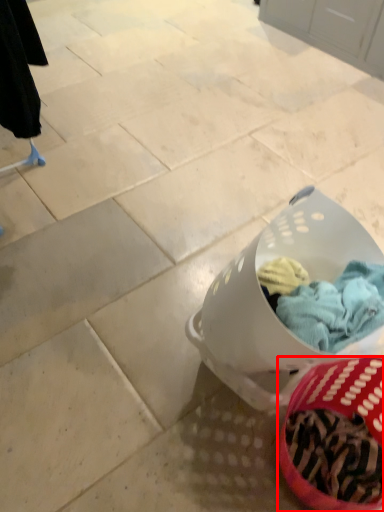
Question: In this image, where is basket (annotated by the red box) located relative to laundry basket?

Choices:
 (A) left
 (B) right

Answer: (B)